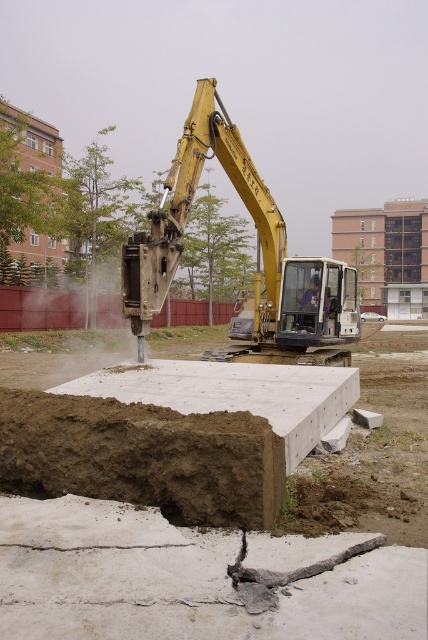
You are a safety inspector at the construction site. You need to ensure that the brown clay dirt at center and the yellow metallic excavator at center are positioned safely. Based on their sizes, which object takes up more space in the area?

The yellow metallic excavator at center takes up more space than the brown clay dirt at center because it is larger in size according to the description.

You are a construction worker standing at the edge of the hole created by the yellow metallic excavator at center. You need to place a safety barrier exactly at the point marked by coordinates [256,248]. Can you confirm if this point is located on the excavator itself or somewhere else in the scene?

The point [256,248] indicates the yellow metallic excavator at center, so the safety barrier would be placed directly on the excavator itself.